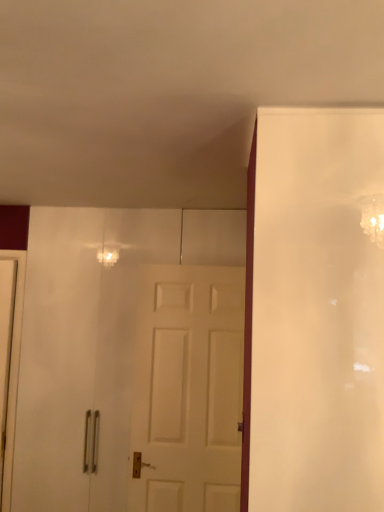
The image size is (384, 512). What do you see at coordinates (126, 368) in the screenshot?
I see `white glossy door at center` at bounding box center [126, 368].

Find the location of a particular element. white glossy door at center is located at coordinates (126, 368).

The image size is (384, 512). Identify the location of white glossy door at center. (126, 368).